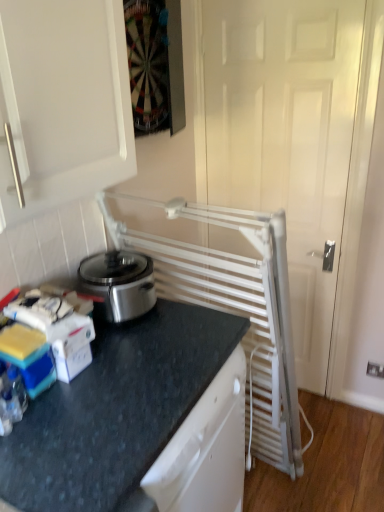
Question: Should I look upward or downward to see white metallic radiator at right?

Choices:
 (A) down
 (B) up

Answer: (B)

Question: Considering the relative sizes of black granite countertop at lower left and white plastic electric outlet at lower right in the image provided, is black granite countertop at lower left smaller than white plastic electric outlet at lower right?

Choices:
 (A) yes
 (B) no

Answer: (B)

Question: Is black granite countertop at lower left oriented towards white plastic electric outlet at lower right?

Choices:
 (A) yes
 (B) no

Answer: (B)

Question: From the image's perspective, does black granite countertop at lower left appear lower than white plastic electric outlet at lower right?

Choices:
 (A) yes
 (B) no

Answer: (A)

Question: Is black granite countertop at lower left next to white plastic electric outlet at lower right and touching it?

Choices:
 (A) no
 (B) yes

Answer: (A)

Question: Is white plastic electric outlet at lower right a part of black granite countertop at lower left?

Choices:
 (A) no
 (B) yes

Answer: (A)

Question: Is black granite countertop at lower left taller than white plastic electric outlet at lower right?

Choices:
 (A) no
 (B) yes

Answer: (B)

Question: Is black granite countertop at lower left directly adjacent to white metallic radiator at right?

Choices:
 (A) yes
 (B) no

Answer: (B)

Question: Considering the relative sizes of black granite countertop at lower left and white metallic radiator at right in the image provided, is black granite countertop at lower left thinner than white metallic radiator at right?

Choices:
 (A) no
 (B) yes

Answer: (A)

Question: Is black granite countertop at lower left shorter than white metallic radiator at right?

Choices:
 (A) no
 (B) yes

Answer: (B)

Question: Does black granite countertop at lower left come behind white metallic radiator at right?

Choices:
 (A) no
 (B) yes

Answer: (A)

Question: Can you confirm if black granite countertop at lower left is bigger than white metallic radiator at right?

Choices:
 (A) no
 (B) yes

Answer: (B)

Question: Considering the relative sizes of black granite countertop at lower left and white metallic radiator at right in the image provided, is black granite countertop at lower left smaller than white metallic radiator at right?

Choices:
 (A) no
 (B) yes

Answer: (A)

Question: Is white plastic electric outlet at lower right located within white metallic radiator at right?

Choices:
 (A) no
 (B) yes

Answer: (A)